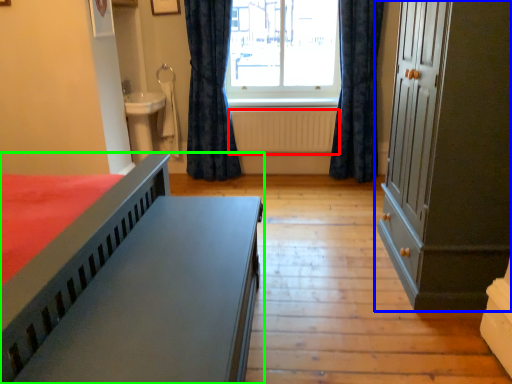
Question: Estimate the real-world distances between objects in this image. Which object is closer to radiator (highlighted by a red box), cupboard (highlighted by a blue box) or bed (highlighted by a green box)?

Choices:
 (A) cupboard
 (B) bed

Answer: (A)